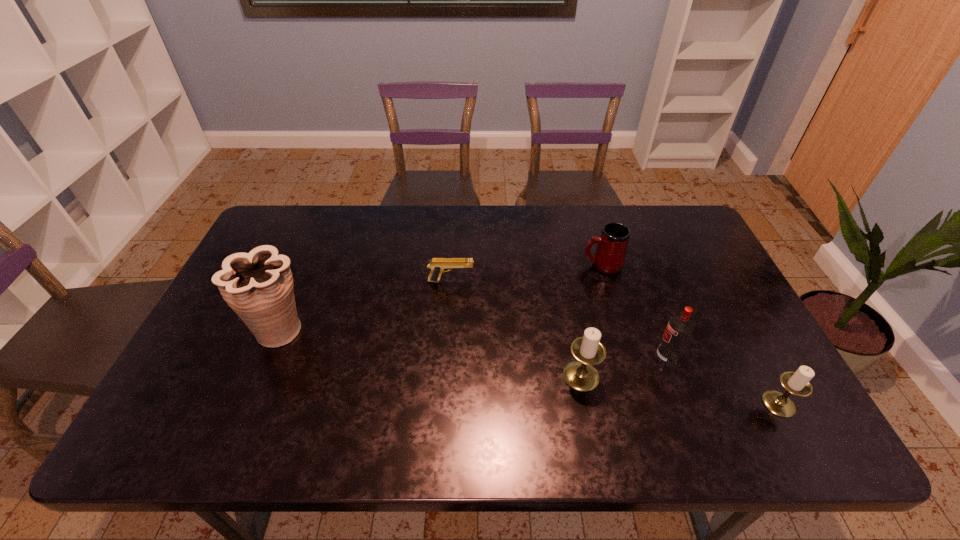
The width and height of the screenshot is (960, 540). I want to click on object that is the fourth nearest to the fourth object from right to left, so click(x=797, y=383).

Where is `free space that satisfies the following two spatial constraints: 1. at the barrel of the rightmost object; 2. on the left side of the pistol`? The height and width of the screenshot is (540, 960). free space that satisfies the following two spatial constraints: 1. at the barrel of the rightmost object; 2. on the left side of the pistol is located at coordinates (443, 404).

Locate an element on the screen. Image resolution: width=960 pixels, height=540 pixels. vacant region that satisfies the following two spatial constraints: 1. at the barrel of the fifth nearest object; 2. on the right side of the shorter candle holder is located at coordinates (443, 404).

Identify the location of free region that satisfies the following two spatial constraints: 1. on the front label of the vodka; 2. on the right side of the rightmost object. (684, 404).

I want to click on vacant space that satisfies the following two spatial constraints: 1. on the front side of the left candle holder; 2. on the left side of the leftmost object, so click(x=262, y=376).